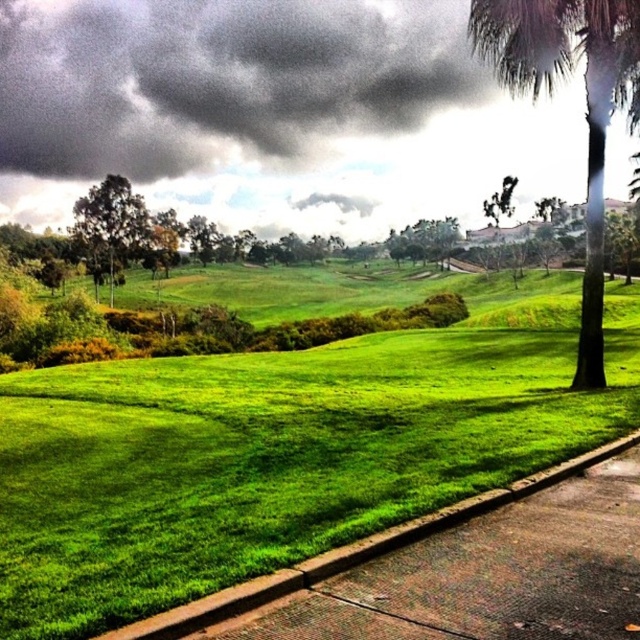
How far apart are green leafy palm tree at center-right and green leafy tree at upper right?

green leafy palm tree at center-right and green leafy tree at upper right are 90.68 meters apart from each other.

Does green leafy palm tree at center-right have a larger size compared to green leafy tree at upper right?

Indeed, green leafy palm tree at center-right has a larger size compared to green leafy tree at upper right.

What do you see at coordinates (586, 106) in the screenshot? I see `green leafy palm tree at center-right` at bounding box center [586, 106].

This screenshot has height=640, width=640. What are the coordinates of `green leafy palm tree at center-right` in the screenshot? It's located at (586, 106).

Does green leafy palm tree at center-right appear on the right side of green leafy tree at left?

Indeed, green leafy palm tree at center-right is positioned on the right side of green leafy tree at left.

Between green leafy palm tree at center-right and green leafy tree at left, which one has more height?

green leafy palm tree at center-right

Identify the location of green leafy palm tree at center-right. The image size is (640, 640). [586, 106].

What are the coordinates of `green leafy palm tree at center-right` in the screenshot? It's located at (586, 106).

Find the location of a particular element. Image resolution: width=640 pixels, height=640 pixels. green leafy tree at left is located at coordinates (112, 220).

Can you confirm if green leafy tree at left is smaller than green leafy tree at upper right?

Indeed, green leafy tree at left has a smaller size compared to green leafy tree at upper right.

The image size is (640, 640). I want to click on green leafy tree at left, so click(112, 220).